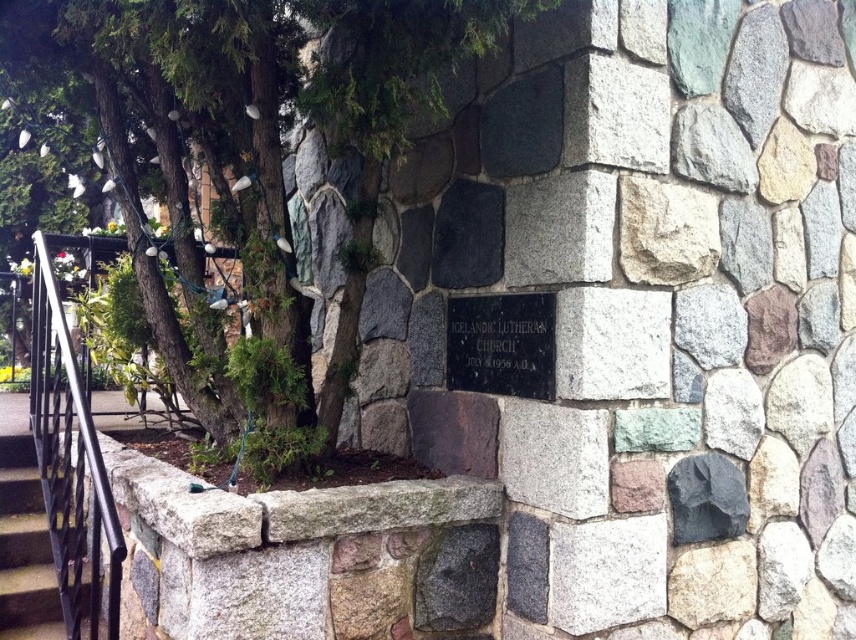
Question: Where is green leafy tree at center located in relation to black metal stairs at lower left in the image?

Choices:
 (A) left
 (B) right

Answer: (B)

Question: Estimate the real-world distances between objects in this image. Which object is closer to the black wrought iron railing at left?

Choices:
 (A) black metal stairs at lower left
 (B) black polished stone plaque at center

Answer: (A)

Question: Among these objects, which one is nearest to the camera?

Choices:
 (A) black wrought iron railing at left
 (B) black polished stone plaque at center
 (C) green leafy tree at center

Answer: (A)

Question: Is black polished stone plaque at center to the left of black metal stairs at lower left from the viewer's perspective?

Choices:
 (A) no
 (B) yes

Answer: (A)

Question: Which object is positioned farthest from the black wrought iron railing at left?

Choices:
 (A) green leafy tree at center
 (B) black polished stone plaque at center
 (C) black metal stairs at lower left

Answer: (B)

Question: Considering the relative positions of green leafy tree at center and black metal stairs at lower left in the image provided, where is green leafy tree at center located with respect to black metal stairs at lower left?

Choices:
 (A) below
 (B) above

Answer: (B)